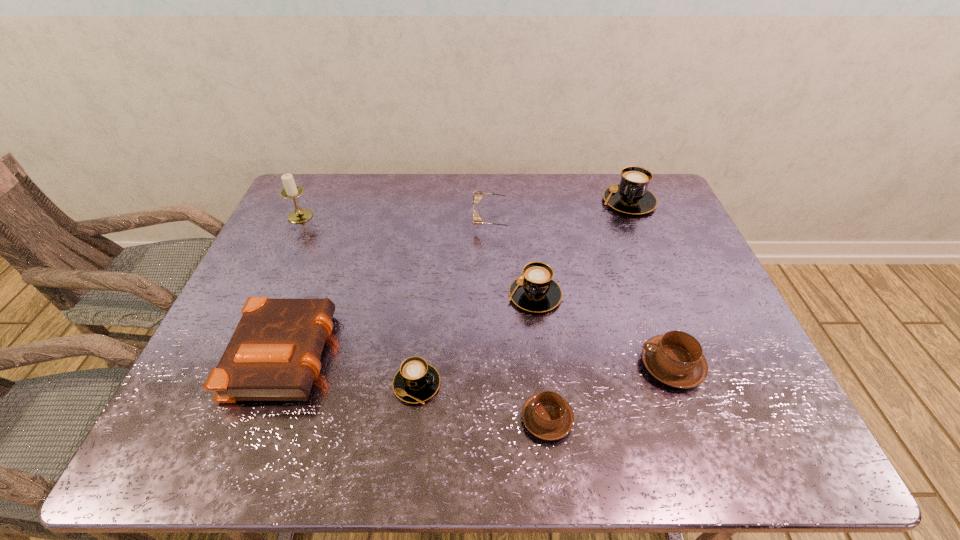
The width and height of the screenshot is (960, 540). Find the location of `the sixth object from right to left`. the sixth object from right to left is located at coordinates (416, 381).

The width and height of the screenshot is (960, 540). In order to click on the leftmost black cappuccino in this screenshot , I will do `click(416, 381)`.

At what (x,y) coordinates should I click in order to perform the action: click on the nearer brown cappuccino. Please return your answer as a coordinate pair (x, y). The height and width of the screenshot is (540, 960). Looking at the image, I should click on (547, 415).

This screenshot has width=960, height=540. What are the coordinates of `the smaller brown cappuccino` in the screenshot? It's located at (547, 415).

The image size is (960, 540). What are the coordinates of `free location located on the right of the candle holder` in the screenshot? It's located at coord(378,216).

The height and width of the screenshot is (540, 960). I want to click on vacant region located on the front of the seventh shortest object, so click(640, 232).

Where is `vacant area located on the back of the second nearest black cappuccino`? The image size is (960, 540). vacant area located on the back of the second nearest black cappuccino is located at coordinates (529, 246).

Locate an element on the screen. Image resolution: width=960 pixels, height=540 pixels. blank space located on the front lenses of the sunglasses is located at coordinates (442, 220).

At what (x,y) coordinates should I click in order to perform the action: click on vacant position located on the front lenses of the sunglasses. Please return your answer as a coordinate pair (x, y). The height and width of the screenshot is (540, 960). Looking at the image, I should click on (353, 220).

Identify the location of vacant space located 0.070m on the front lenses of the sunglasses. (451, 220).